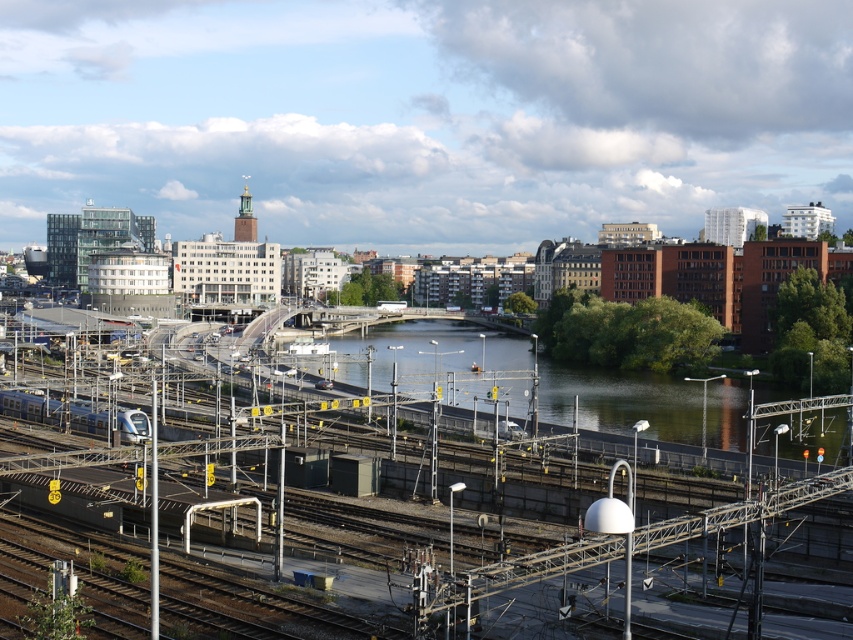
You are standing at the point with coordinates point (619, 401) in the railway yard. What is the nearest object to you?

The nearest object to point (619, 401) is green water at center since the point is located on it.

You are standing at the railway yard in the image and want to locate two specific points. The first point is at coordinates point (x=556, y=401) and the second is at point (x=137, y=420). Which of these two points is closer to your current position?

Point (x=137, y=420) is closer to your current position because it is nearer to the camera compared to point (x=556, y=401), which is further away.

You are a city planner analyzing the urban layout. Given the green water at center and the silver metallic train at lower left, which one occupies a larger area in the image?

The green water at center has a greater width than the silver metallic train at lower left, so it occupies a larger area in the image.